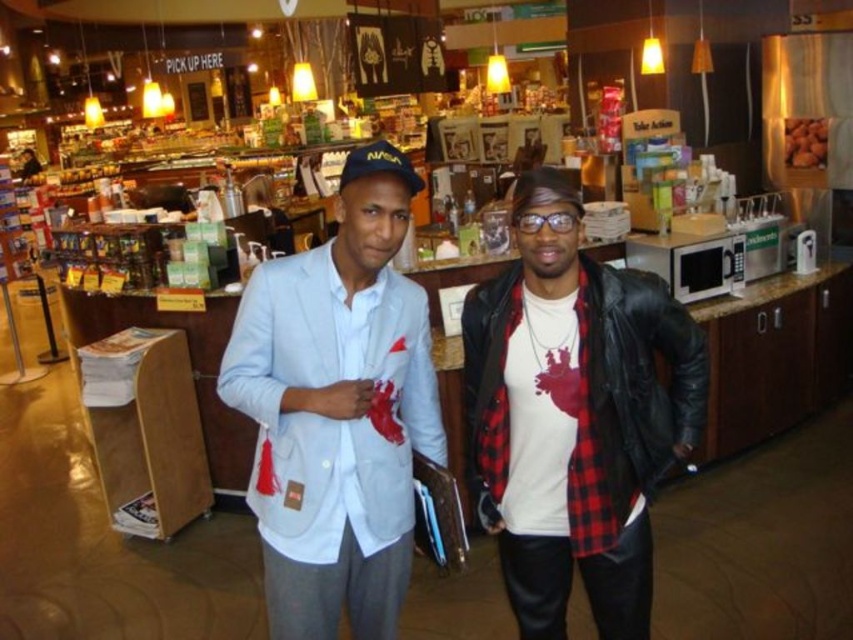
Question: Which object is positioned farthest from the brown matte nuts at upper right?

Choices:
 (A) light blue fabric jacket at center
 (B) matte black jacket at center

Answer: (A)

Question: Does light blue cotton blazer at center appear over light blue fabric jacket at center?

Choices:
 (A) yes
 (B) no

Answer: (B)

Question: Is light blue cotton blazer at center below brown matte nuts at upper right?

Choices:
 (A) yes
 (B) no

Answer: (A)

Question: Which object appears farthest from the camera in this image?

Choices:
 (A) brown matte nuts at upper right
 (B) light blue cotton blazer at center
 (C) matte black jacket at center

Answer: (A)

Question: Which of these objects is positioned farthest from the matte black jacket at center?

Choices:
 (A) brown matte nuts at upper right
 (B) light blue cotton blazer at center
 (C) light blue fabric jacket at center

Answer: (A)

Question: Can you confirm if light blue cotton blazer at center is smaller than light blue fabric jacket at center?

Choices:
 (A) yes
 (B) no

Answer: (B)